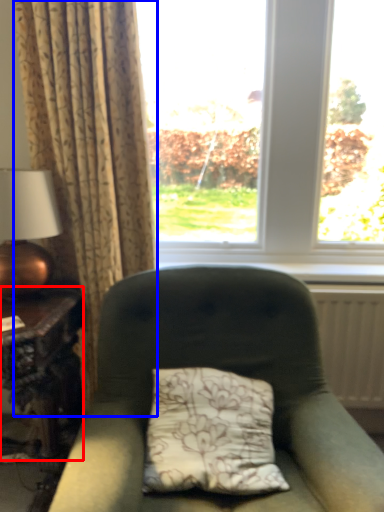
Question: Which of the following is the farthest to the observer, table (highlighted by a red box) or curtain (highlighted by a blue box)?

Choices:
 (A) table
 (B) curtain

Answer: (B)